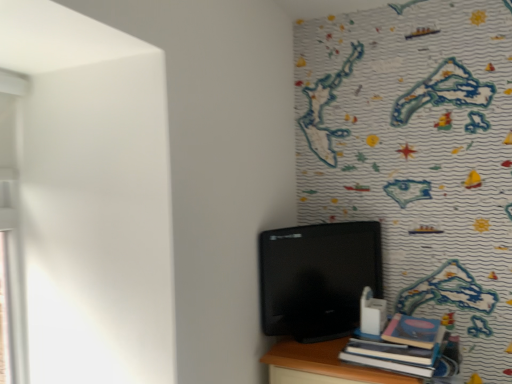
Question: Is black glossy monitor at center taller than hardcover book at lower right?

Choices:
 (A) no
 (B) yes

Answer: (B)

Question: Can you confirm if black glossy monitor at center is shorter than hardcover book at lower right?

Choices:
 (A) yes
 (B) no

Answer: (B)

Question: Is black glossy monitor at center oriented towards hardcover book at lower right?

Choices:
 (A) no
 (B) yes

Answer: (B)

Question: From the image's perspective, is black glossy monitor at center located above hardcover book at lower right?

Choices:
 (A) yes
 (B) no

Answer: (A)

Question: Considering the relative positions of black glossy monitor at center and hardcover book at lower right in the image provided, is black glossy monitor at center in front of hardcover book at lower right?

Choices:
 (A) yes
 (B) no

Answer: (B)

Question: Is black glossy monitor at center outside of hardcover book at lower right?

Choices:
 (A) no
 (B) yes

Answer: (B)

Question: Is hardcover book at lower right to the right of black glossy monitor at center from the viewer's perspective?

Choices:
 (A) yes
 (B) no

Answer: (A)

Question: From the image's perspective, is hardcover book at lower right located above black glossy monitor at center?

Choices:
 (A) yes
 (B) no

Answer: (B)

Question: From the image's perspective, would you say hardcover book at lower right is shown under black glossy monitor at center?

Choices:
 (A) no
 (B) yes

Answer: (B)

Question: Is the surface of hardcover book at lower right in direct contact with black glossy monitor at center?

Choices:
 (A) yes
 (B) no

Answer: (B)

Question: Does hardcover book at lower right have a greater height compared to black glossy monitor at center?

Choices:
 (A) yes
 (B) no

Answer: (B)

Question: Considering the relative sizes of hardcover book at lower right and black glossy monitor at center in the image provided, is hardcover book at lower right thinner than black glossy monitor at center?

Choices:
 (A) no
 (B) yes

Answer: (A)

Question: Is hardcover book at lower right wider or thinner than black glossy monitor at center?

Choices:
 (A) wide
 (B) thin

Answer: (A)